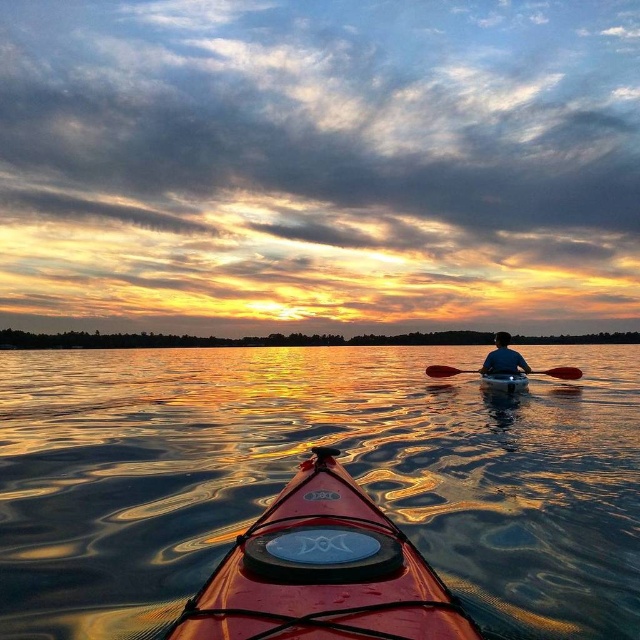
Question: Is the position of shiny red kayak at center more distant than that of blue fabric person at center?

Choices:
 (A) no
 (B) yes

Answer: (A)

Question: Among these points, which one is nearest to the camera?

Choices:
 (A) (296, 525)
 (B) (572, 376)
 (C) (493, 358)

Answer: (A)

Question: Is blue fabric person at center smaller than matte orange canoe at center?

Choices:
 (A) no
 (B) yes

Answer: (A)

Question: Which point is farther to the camera?

Choices:
 (A) matte orange canoe at center
 (B) blue fabric person at center
 (C) shiny red kayak at center
 (D) black rubber paddle at center

Answer: (D)

Question: Which object is the closest to the shiny red kayak at center?

Choices:
 (A) blue fabric person at center
 (B) matte orange canoe at center
 (C) glossy water at center

Answer: (C)

Question: Does shiny red kayak at center appear under black rubber paddle at center?

Choices:
 (A) yes
 (B) no

Answer: (B)